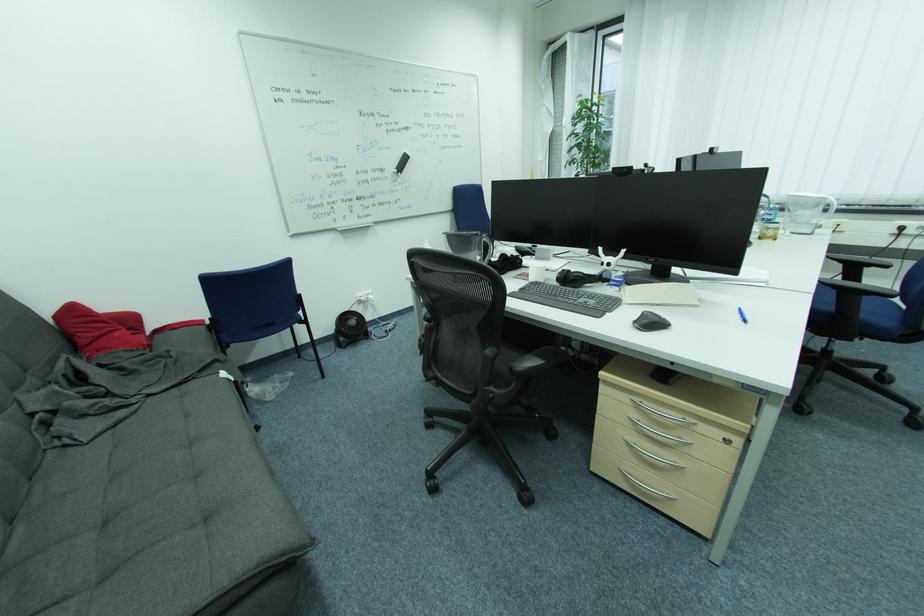
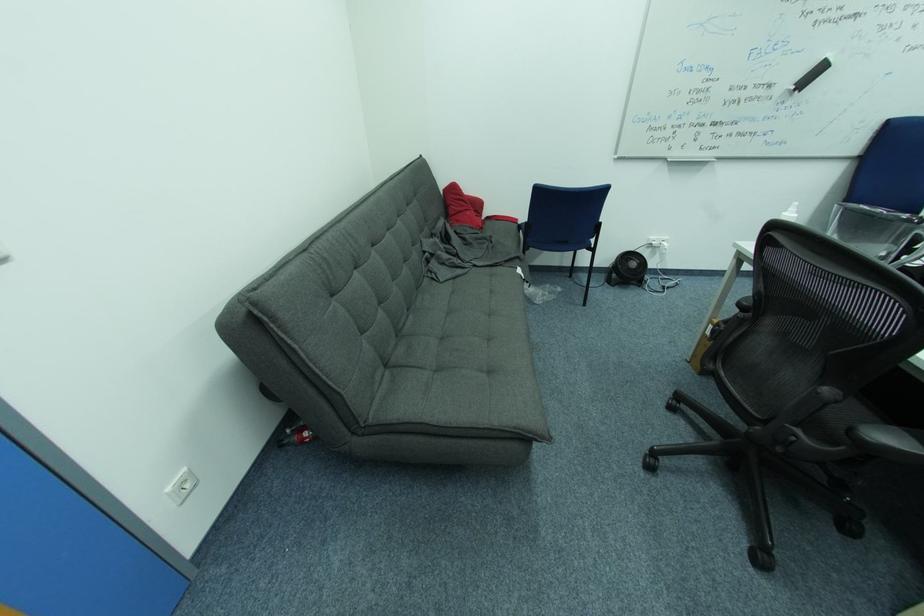
Where in the second image is the point corresponding to (517,370) from the first image?

(858, 430)